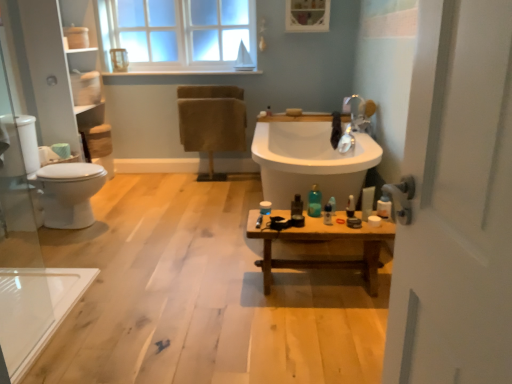
The width and height of the screenshot is (512, 384). I want to click on free area behind translucent plastic bottle at center, the third toiletry viewed from the left, so click(x=328, y=211).